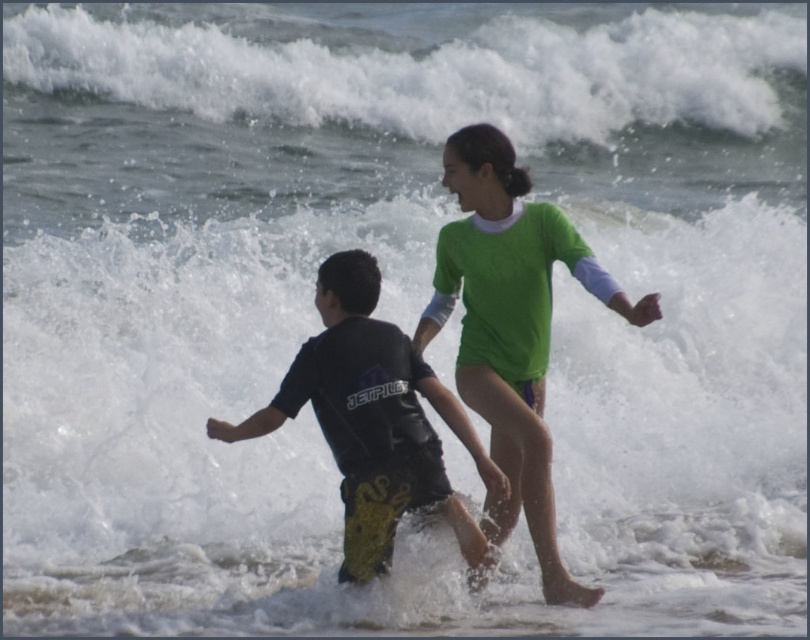
Is point (249, 52) closer to viewer compared to point (433, 305)?

No, (249, 52) is behind (433, 305).

Between white frothy wave at upper center and green fabric swimsuit at center, which one is positioned lower?

green fabric swimsuit at center

Is point (301, 70) less distant than point (551, 216)?

No.

Identify the location of white frothy wave at upper center. (425, 65).

Is white frothy wave at upper center to the right of black matte wetsuit at center from the viewer's perspective?

Correct, you'll find white frothy wave at upper center to the right of black matte wetsuit at center.

Between white frothy wave at upper center and black matte wetsuit at center, which one appears on the left side from the viewer's perspective?

black matte wetsuit at center is more to the left.

Where is `white frothy wave at upper center`? white frothy wave at upper center is located at coordinates (425, 65).

The width and height of the screenshot is (810, 640). I want to click on white frothy wave at upper center, so click(425, 65).

This screenshot has height=640, width=810. I want to click on green fabric swimsuit at center, so click(x=510, y=326).

The image size is (810, 640). I want to click on green fabric swimsuit at center, so click(510, 326).

I want to click on green fabric swimsuit at center, so click(510, 326).